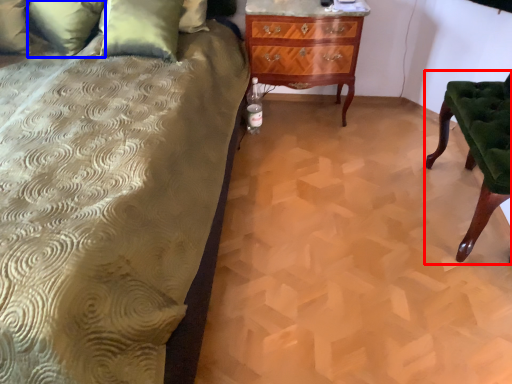
Question: Which object is closer to the camera taking this photo, furniture (highlighted by a red box) or pillow (highlighted by a blue box)?

Choices:
 (A) furniture
 (B) pillow

Answer: (A)